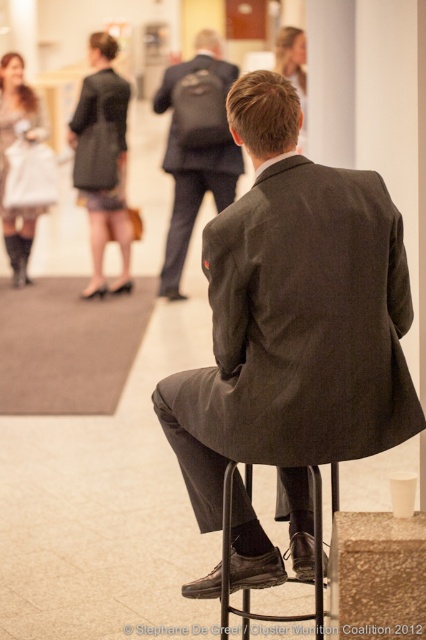
You are a guest at this event and need to find a place to temporarily store your belongings. You see the dark gray textured coat at upper left and the matte black boots at left. Which object is positioned higher up in the image?

The dark gray textured coat at upper left is taller than the matte black boots at left, so it is positioned higher up in the image.

You are standing at the camera position and want to reach the point marked at coordinates (176, 179). If you walk straight ahead, how far will you have to walk to reach that point?

The point marked at coordinates (176, 179) is 8.33 meters away from the camera position, so you will have to walk 8.33 meters straight ahead to reach it.